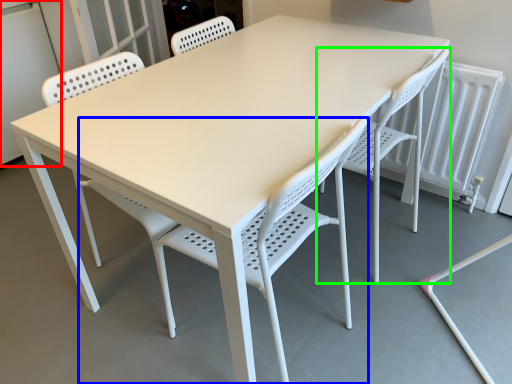
Question: Based on their relative distances, which object is farther from screen door (highlighted by a red box)? Choose from chair (highlighted by a blue box) and chair (highlighted by a green box).

Choices:
 (A) chair
 (B) chair

Answer: (B)